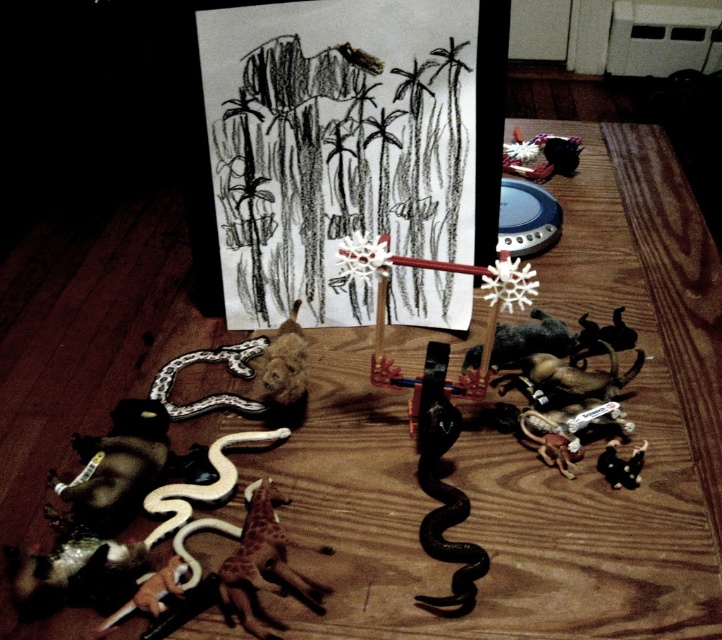
Looking at this image, is black rubber snake at center positioned at the back of speckled plastic snake at lower left?

That is False.

Can you confirm if black rubber snake at center is taller than speckled plastic snake at lower left?

Yes.

Describe the element at coordinates (445, 508) in the screenshot. I see `black rubber snake at center` at that location.

This screenshot has height=640, width=722. I want to click on black rubber snake at center, so click(445, 508).